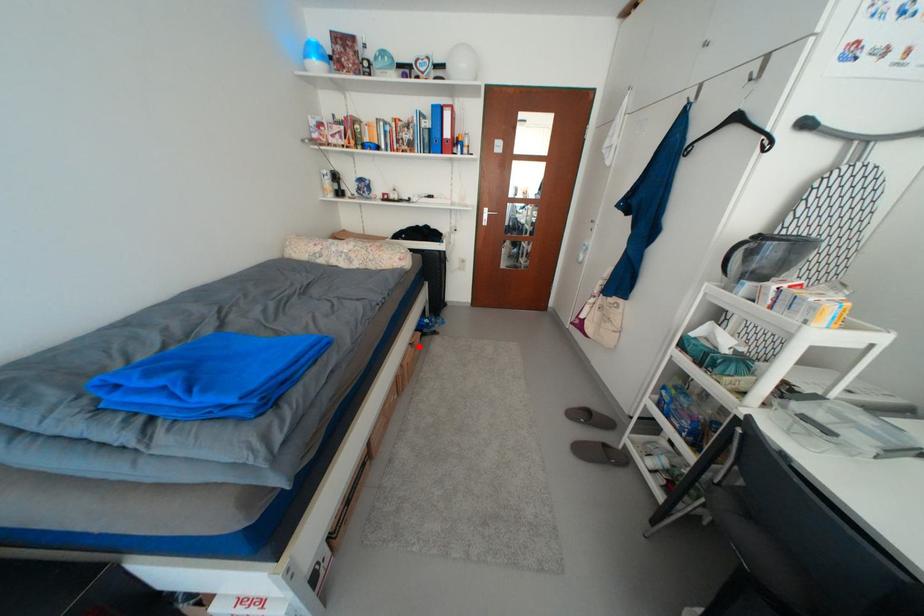
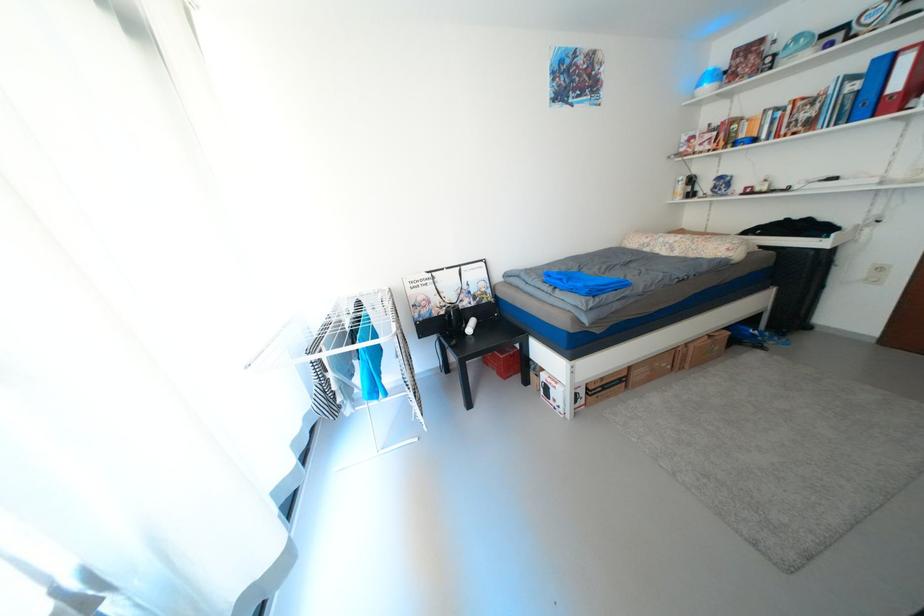
Question: A red point is marked in image1. In image2, is the corresponding 3D point closer to the camera or farther? Reply with the corresponding letter.

Choices:
 (A) The corresponding 3D point is closer.
 (B) The corresponding 3D point is farther.

Answer: (B)